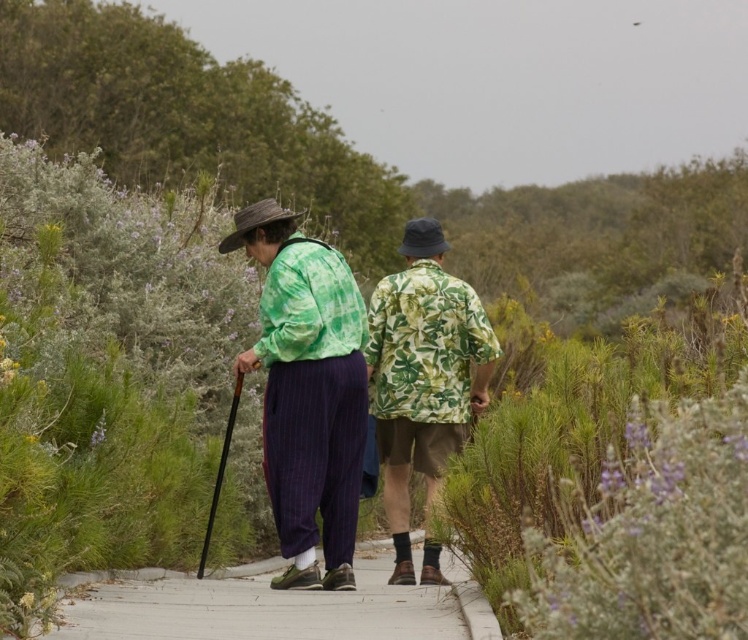
Question: Which point is closer to the camera taking this photo?

Choices:
 (A) [x=278, y=525]
 (B) [x=159, y=600]
 (C) [x=432, y=566]

Answer: (B)

Question: Does green fabric shirt at center have a greater width compared to concrete at center?

Choices:
 (A) no
 (B) yes

Answer: (A)

Question: Which point is closer to the camera?

Choices:
 (A) green leafy fabric shirt at center
 (B) concrete at center

Answer: (B)

Question: Can you confirm if concrete at center is wider than green leafy fabric shirt at center?

Choices:
 (A) yes
 (B) no

Answer: (A)

Question: Which of these objects is positioned farthest from the green fabric shirt at center?

Choices:
 (A) green leafy fabric shirt at center
 (B) concrete at center

Answer: (B)

Question: Does green fabric shirt at center lie behind concrete at center?

Choices:
 (A) yes
 (B) no

Answer: (A)